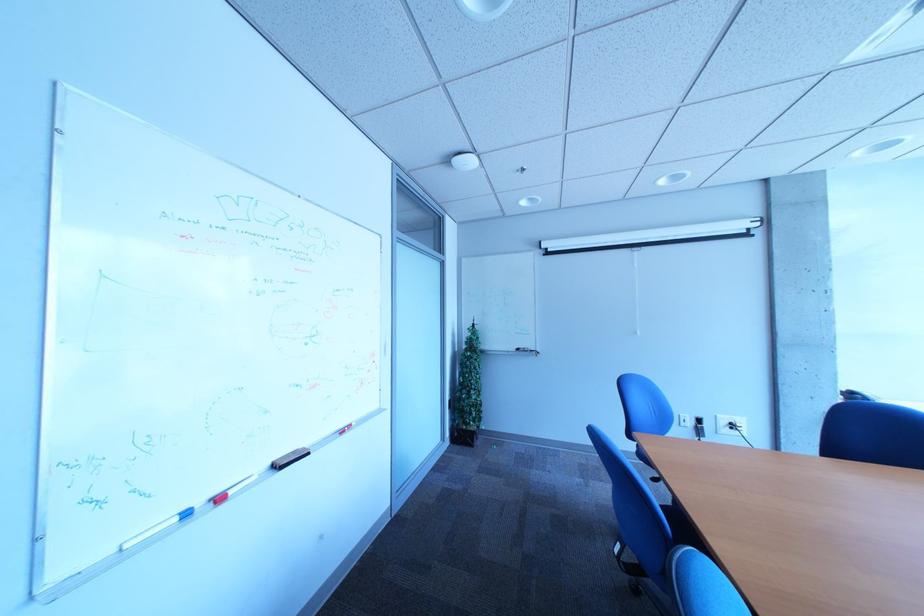
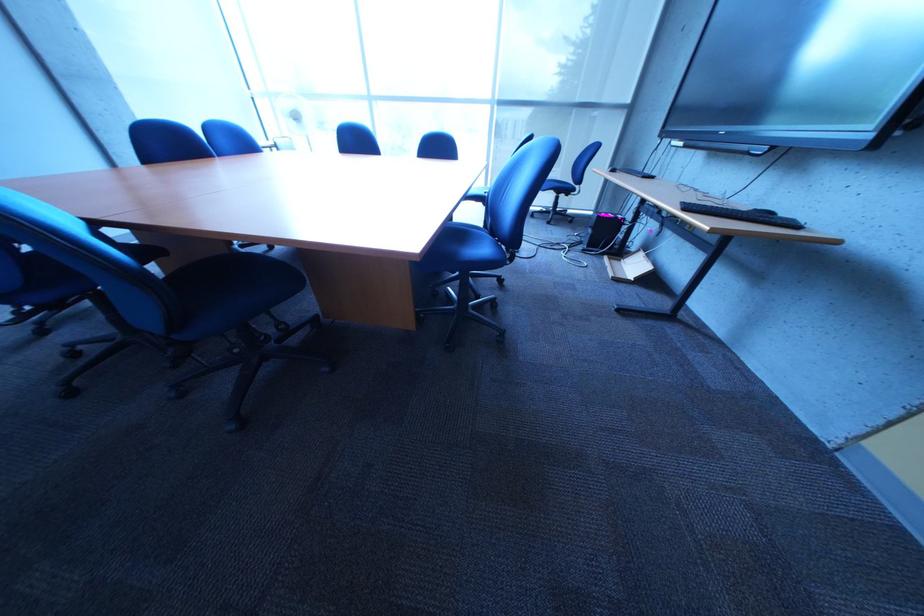
The images are taken continuously from a first-person perspective. In which direction is your viewpoint rotating?

The camera's rotation is toward right-down.